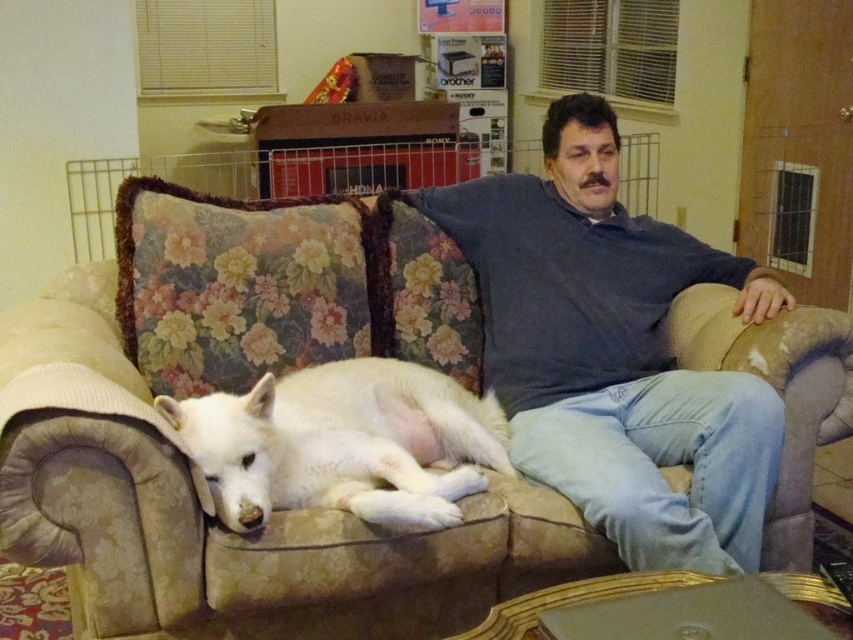
Question: Which object is positioned farthest from the blue cotton shirt at center?

Choices:
 (A) beige floral couch at center
 (B) white fur dog at center

Answer: (B)

Question: Which point appears closest to the camera in this image?

Choices:
 (A) (321, 216)
 (B) (555, 368)
 (C) (412, 440)

Answer: (C)

Question: Is beige floral couch at center to the left of white fur dog at center from the viewer's perspective?

Choices:
 (A) yes
 (B) no

Answer: (A)

Question: Does beige floral couch at center have a smaller size compared to white fur dog at center?

Choices:
 (A) no
 (B) yes

Answer: (A)

Question: Is beige floral couch at center above white fur dog at center?

Choices:
 (A) no
 (B) yes

Answer: (A)

Question: Among these objects, which one is nearest to the camera?

Choices:
 (A) blue cotton shirt at center
 (B) white fur dog at center
 (C) beige floral couch at center

Answer: (C)